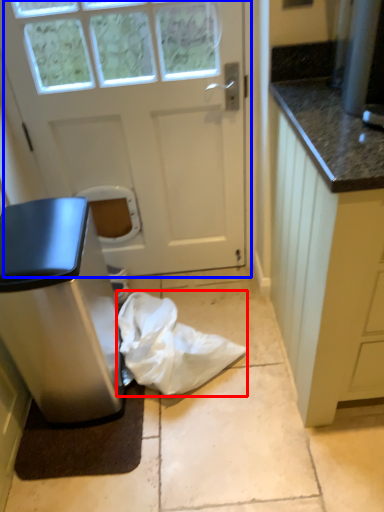
Question: Among these objects, which one is farthest to the camera, material (highlighted by a red box) or door (highlighted by a blue box)?

Choices:
 (A) material
 (B) door

Answer: (A)